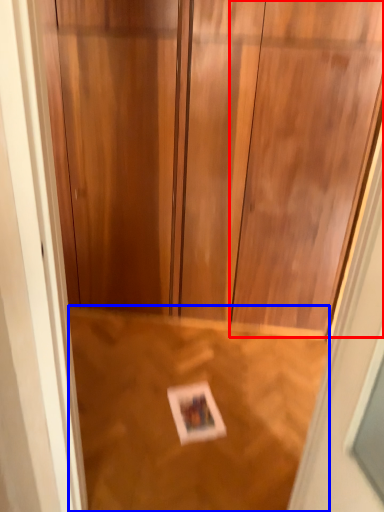
Question: Among these objects, which one is farthest to the camera, door (highlighted by a red box) or plywood (highlighted by a blue box)?

Choices:
 (A) door
 (B) plywood

Answer: (B)